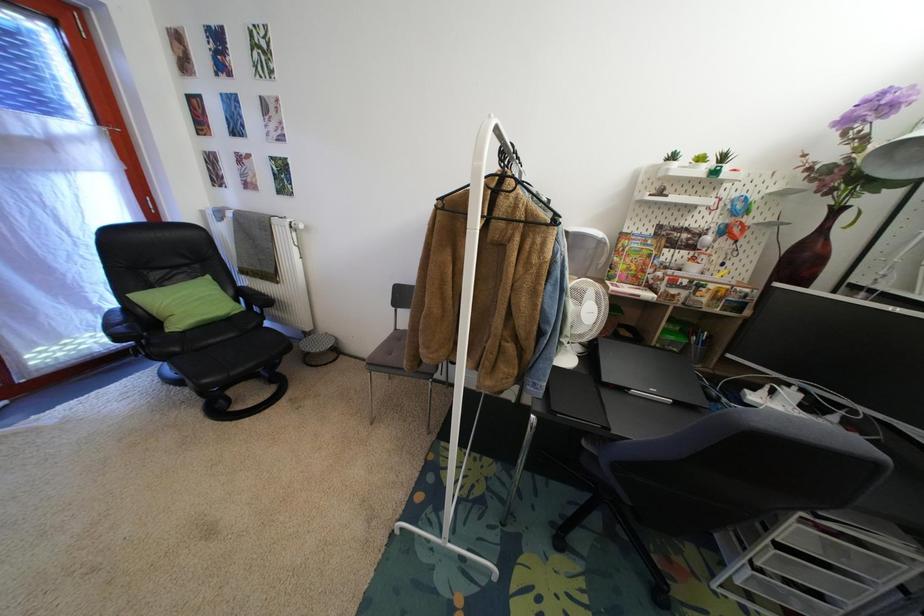
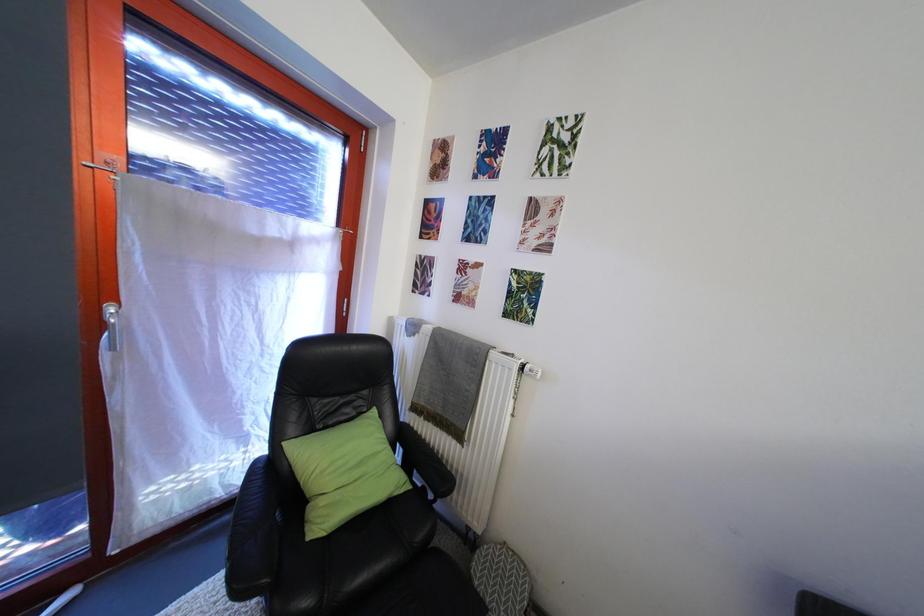
In a continuous first-person perspective shot, in which direction is the camera moving?

The cameraman moved toward left, forward.